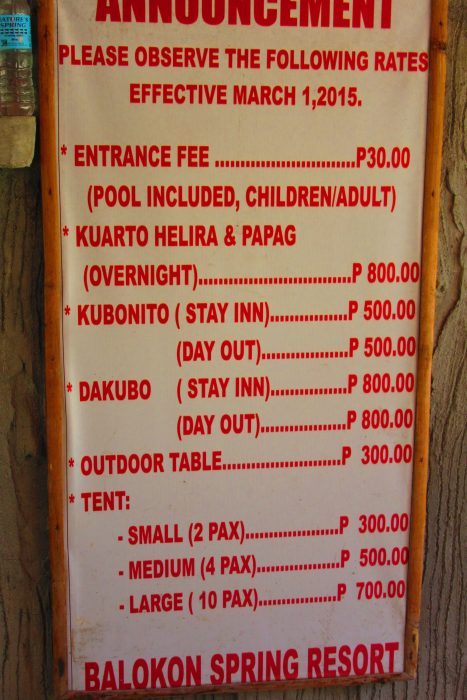
Where is `shelf`? shelf is located at coordinates (12, 138).